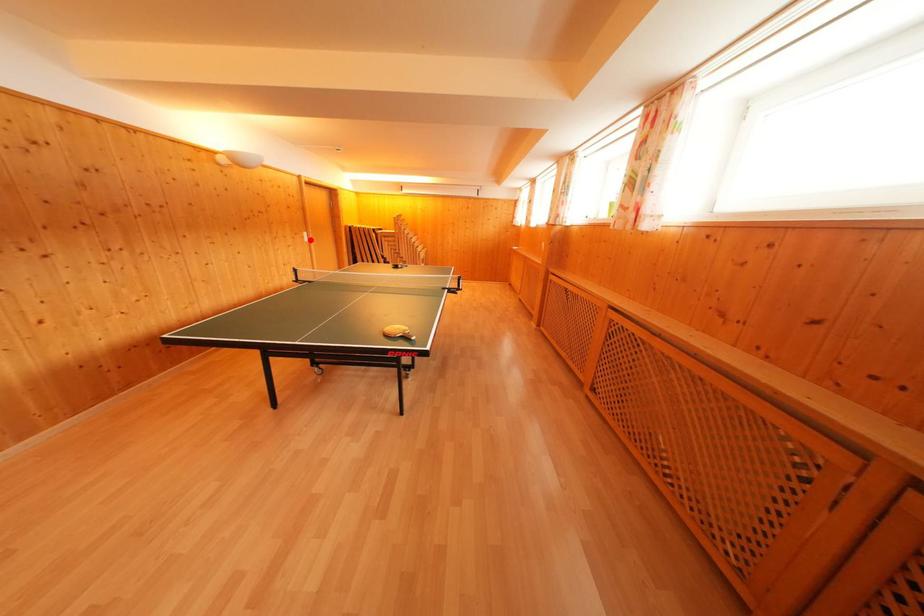
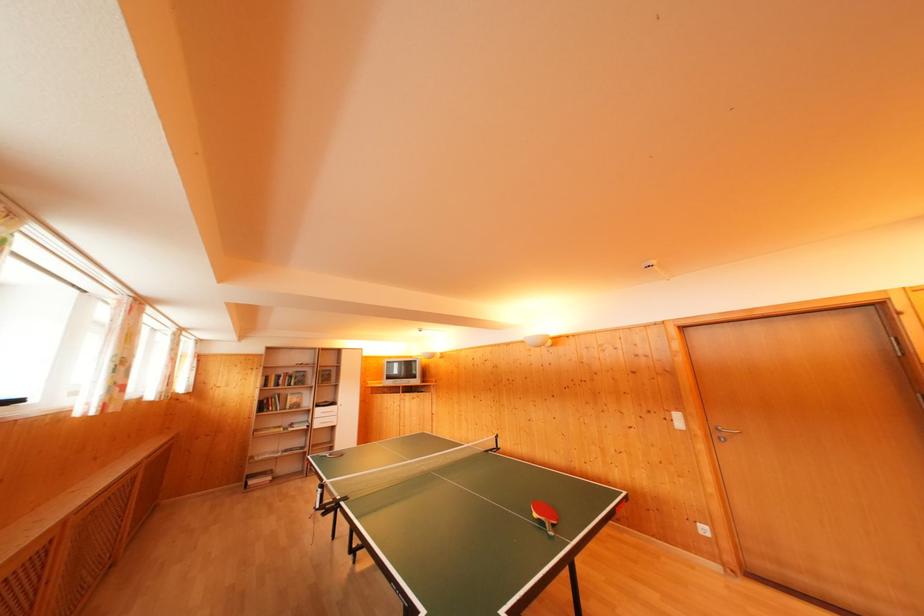
Where in the second image is the point corresponding to the highlighted location from the first image?

(682, 421)